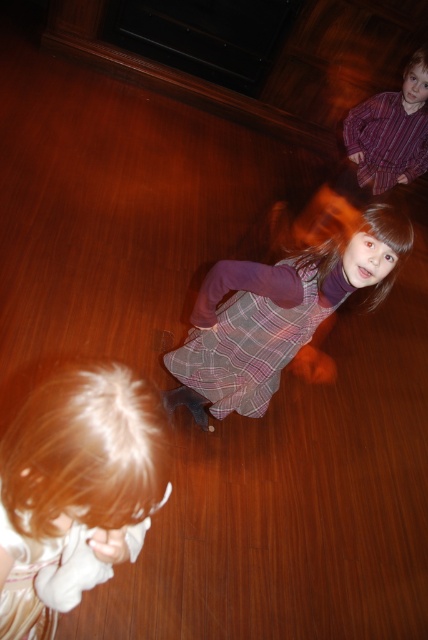
Which is more to the left, blonde hair at lower left or white cotton dress at lower left?

white cotton dress at lower left is more to the left.

Between blonde hair at lower left and white cotton dress at lower left, which one has less height?

white cotton dress at lower left is shorter.

Identify the location of blonde hair at lower left. (76, 490).

Is plaid fabric dress at center positioned in front of striped cotton shirt at upper right?

That is True.

In the scene shown: Between plaid fabric dress at center and striped cotton shirt at upper right, which one appears on the left side from the viewer's perspective?

plaid fabric dress at center

You are a GUI agent. You are given a task and a screenshot of the screen. Output one action in this format:
    pyautogui.click(x=<x>, y=<y>)
    Task: Click on the plaid fabric dress at center
    
    Given the screenshot: What is the action you would take?
    pyautogui.click(x=276, y=314)

Is plaid fabric dress at center to the right of white cotton dress at lower left from the viewer's perspective?

Indeed, plaid fabric dress at center is positioned on the right side of white cotton dress at lower left.

Which of these two, plaid fabric dress at center or white cotton dress at lower left, stands shorter?

With less height is white cotton dress at lower left.

Is point (377, 296) positioned behind point (82, 582)?

Yes, point (377, 296) is farther from viewer.

The height and width of the screenshot is (640, 428). I want to click on plaid fabric dress at center, so click(x=276, y=314).